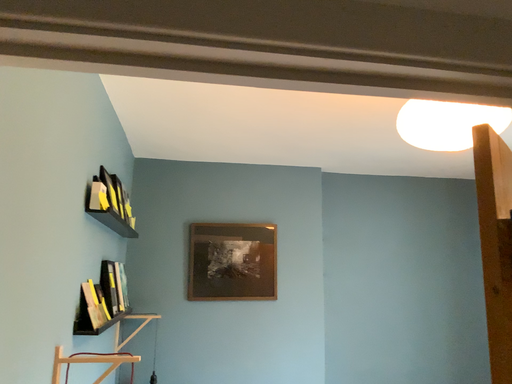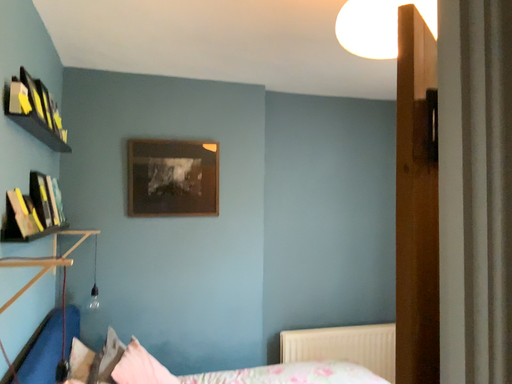
Question: Which way did the camera rotate in the video?

Choices:
 (A) rotated right
 (B) rotated left

Answer: (A)